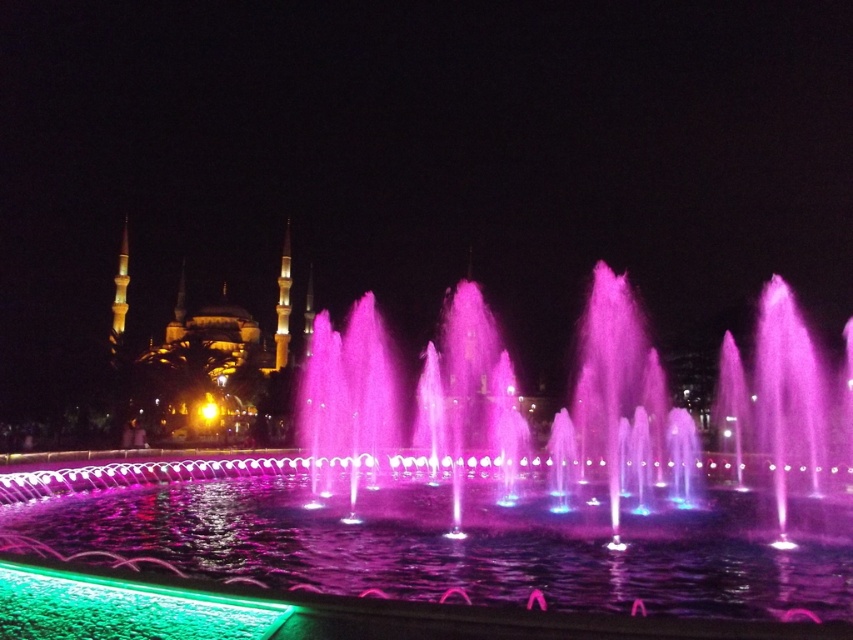
Question: Is pink translucent water at center thinner than green glass water at lower left?

Choices:
 (A) no
 (B) yes

Answer: (A)

Question: From the image, what is the correct spatial relationship of pink translucent water at center in relation to green glass water at lower left?

Choices:
 (A) left
 (B) right

Answer: (B)

Question: Is the position of pink translucent water at center less distant than that of green glass water at lower left?

Choices:
 (A) no
 (B) yes

Answer: (B)